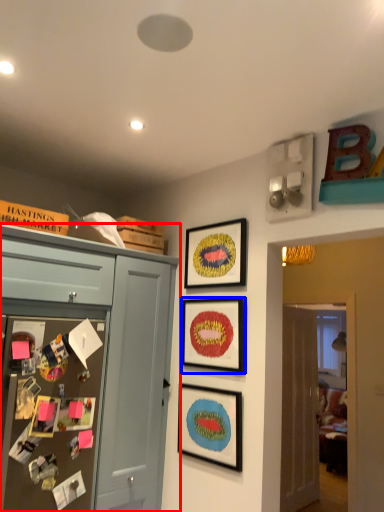
Question: Which object is further to the camera taking this photo, cabinetry (highlighted by a red box) or picture frame (highlighted by a blue box)?

Choices:
 (A) cabinetry
 (B) picture frame

Answer: (B)